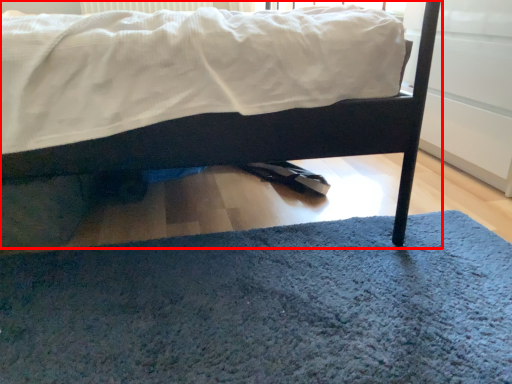
Question: From the image's perspective, considering the relative positions of bed (annotated by the red box) and doormat in the image provided, where is bed (annotated by the red box) located with respect to the staircase?

Choices:
 (A) below
 (B) above

Answer: (B)